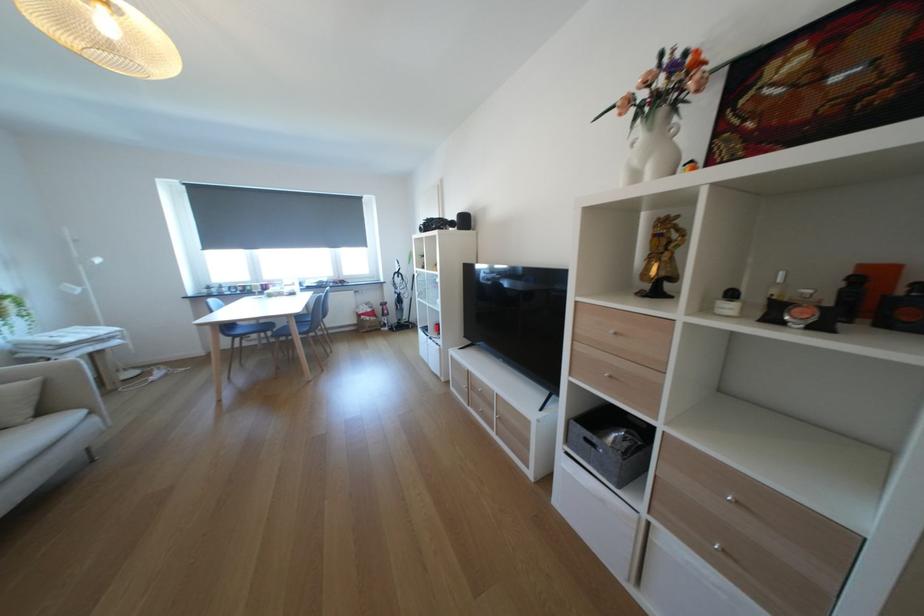
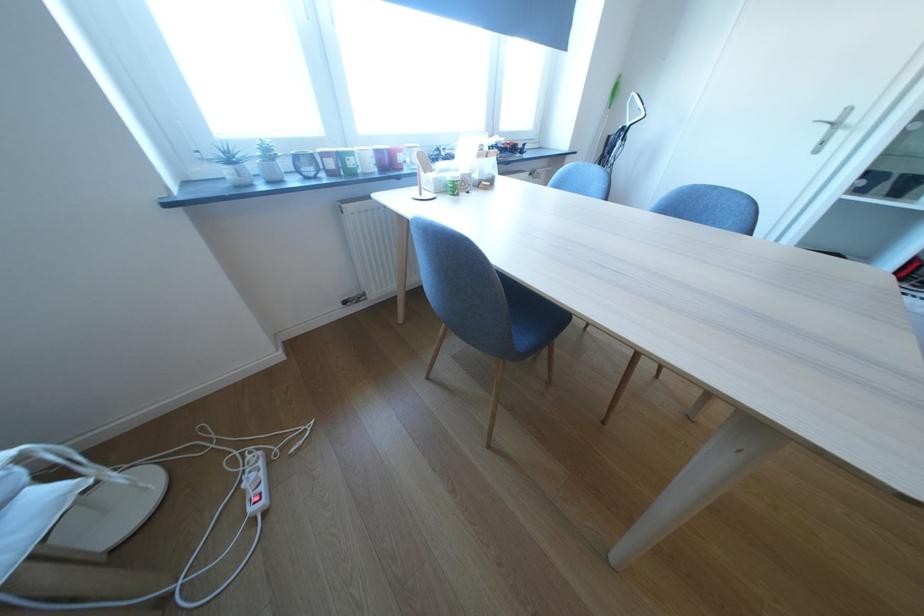
Locate, in the second image, the point that corresponds to point (219, 293) in the first image.

(249, 175)